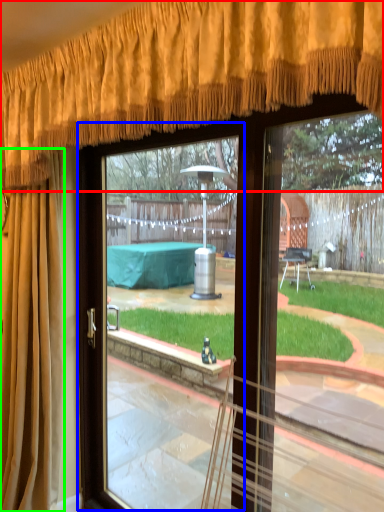
Question: Considering the real-world distances, which object is closest to curtain (highlighted by a red box)? screen door (highlighted by a blue box) or curtain (highlighted by a green box).

Choices:
 (A) screen door
 (B) curtain

Answer: (B)